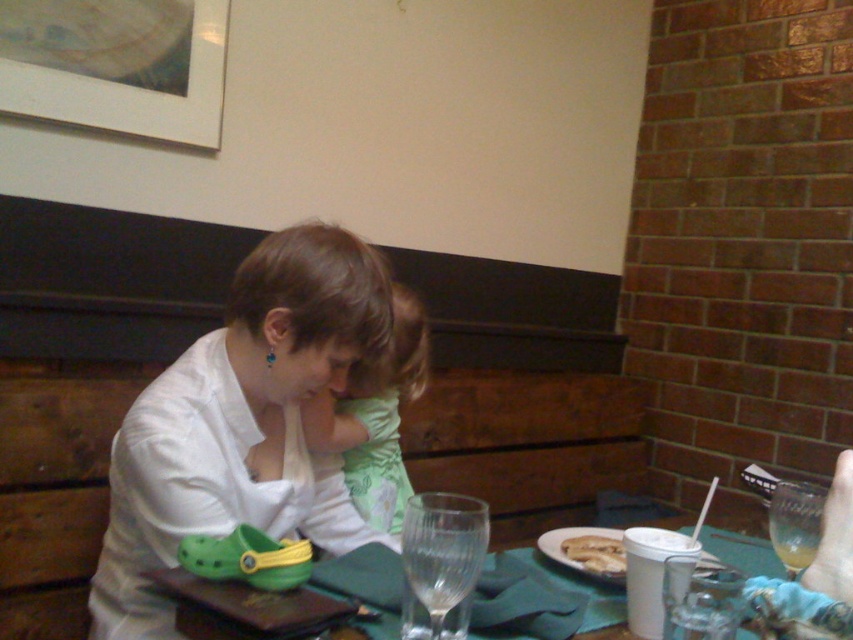
Based on the photo, you are a server at the restaurant and need to place a small bowl of olives between the green fabric shirt at center and the golden crispy bread at lower center. Which object should you move to make space?

The green fabric shirt at center might be wider than golden crispy bread at lower center, so you should move the green fabric shirt at center to make space for the bowl of olives.

You are a server at the restaurant and need to clear the table. The green rubber clog at lower left and the golden crispy bread at lower center are in the way. Which item should you move first to make space for the dishes?

The green rubber clog at lower left might be wider than golden crispy bread at lower center, so moving it first would create more space for clearing the dishes.